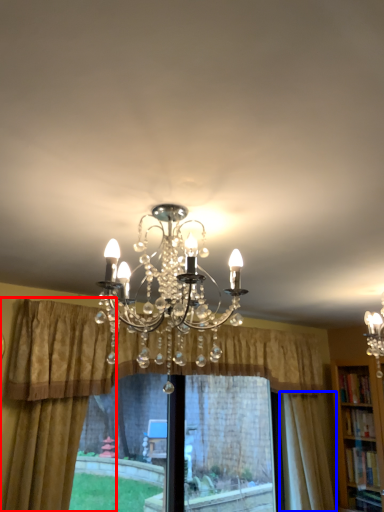
Question: Which object is closer to the camera taking this photo, curtain (highlighted by a red box) or curtain (highlighted by a blue box)?

Choices:
 (A) curtain
 (B) curtain

Answer: (A)